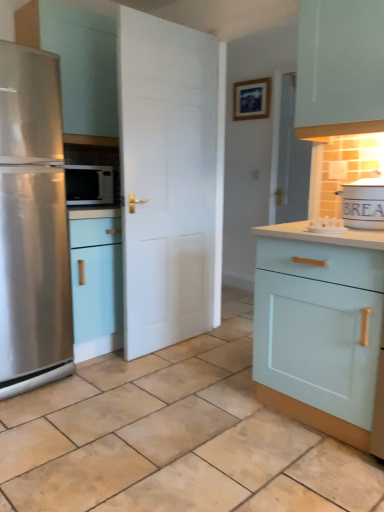
This screenshot has width=384, height=512. In order to click on spots to the right of white matte door at center in this screenshot , I will do `click(213, 349)`.